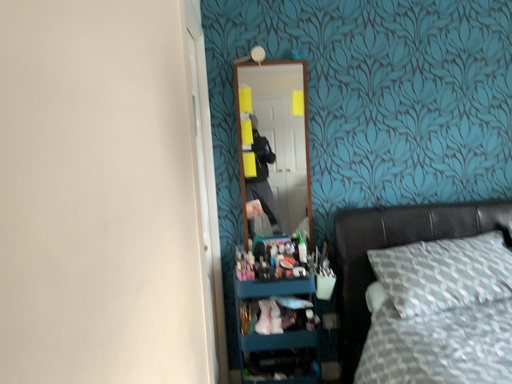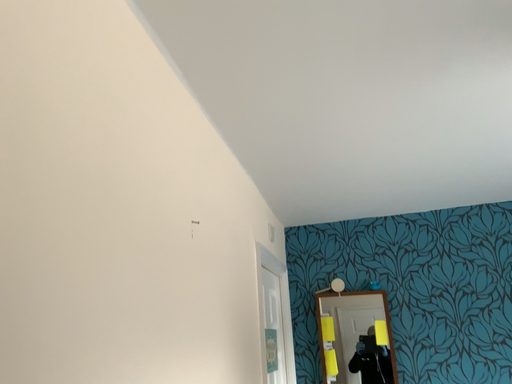
Question: How did the camera likely rotate when shooting the video?

Choices:
 (A) rotated upward
 (B) rotated downward

Answer: (A)